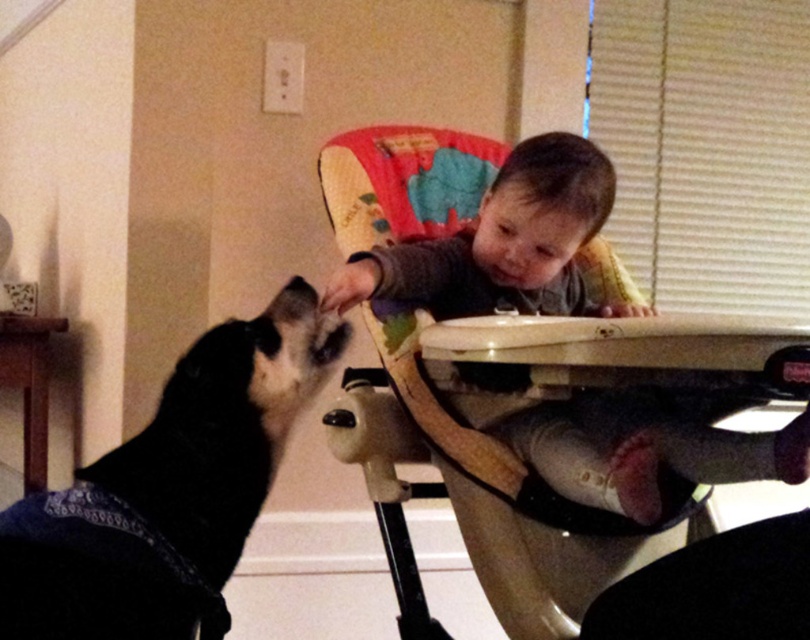
Which is behind, point (608, 196) or point (33, 547)?

The point (608, 196) is behind.

Is beige plastic high chair at center smaller than black fabric dog at left?

Incorrect, beige plastic high chair at center is not smaller in size than black fabric dog at left.

The image size is (810, 640). What do you see at coordinates (546, 404) in the screenshot? I see `beige plastic high chair at center` at bounding box center [546, 404].

At what (x,y) coordinates should I click in order to perform the action: click on beige plastic high chair at center. Please return your answer as a coordinate pair (x, y). Looking at the image, I should click on (546, 404).